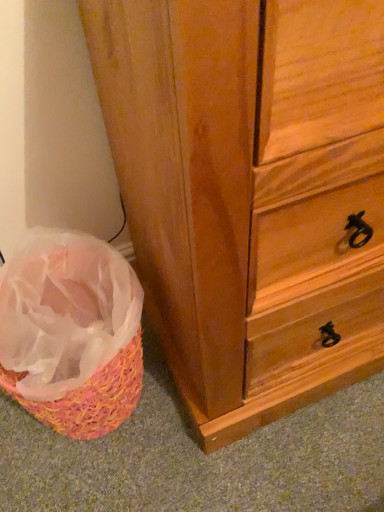
Where is `wooden chest of drawers at lower left`? This screenshot has height=512, width=384. wooden chest of drawers at lower left is located at coordinates (249, 192).

What do you see at coordinates (249, 192) in the screenshot? I see `wooden chest of drawers at lower left` at bounding box center [249, 192].

At what (x,y) coordinates should I click in order to perform the action: click on wooden chest of drawers at lower left. Please return your answer as a coordinate pair (x, y). The height and width of the screenshot is (512, 384). Looking at the image, I should click on (249, 192).